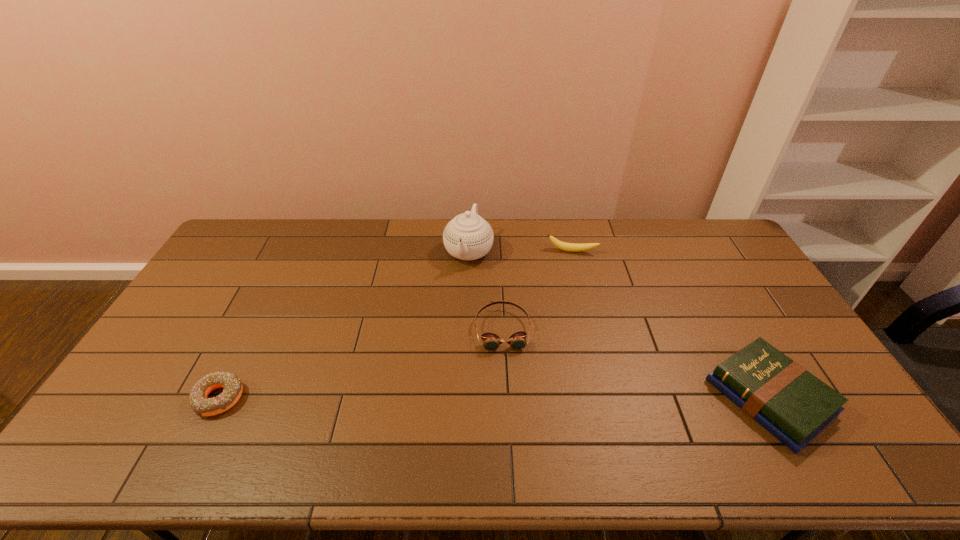
Where is `vacant space that is in between the chinaware and the leftmost object`? The image size is (960, 540). vacant space that is in between the chinaware and the leftmost object is located at coordinates (344, 325).

I want to click on empty location between the tallest object and the goggles, so click(x=486, y=291).

Where is `free space between the chinaware and the shortest object`? The height and width of the screenshot is (540, 960). free space between the chinaware and the shortest object is located at coordinates (344, 325).

This screenshot has height=540, width=960. I want to click on blank region between the book and the tallest object, so click(x=619, y=325).

The image size is (960, 540). What are the coordinates of `empty space between the leftmost object and the banana` in the screenshot? It's located at [396, 325].

Identify the location of free space that is in between the leftmost object and the goggles. The width and height of the screenshot is (960, 540). (361, 363).

Find the location of a particular element. This screenshot has height=540, width=960. vacant area that lies between the leftmost object and the chinaware is located at coordinates (344, 325).

Identify the location of object that stands as the closest to the goggles. The image size is (960, 540). [x=468, y=236].

Identify the location of object that can be found as the closest to the banana. The image size is (960, 540). 468,236.

The height and width of the screenshot is (540, 960). In order to click on free location that satisfies the following two spatial constraints: 1. on the back side of the shortest object; 2. on the left side of the goggles in this screenshot , I will do `click(253, 329)`.